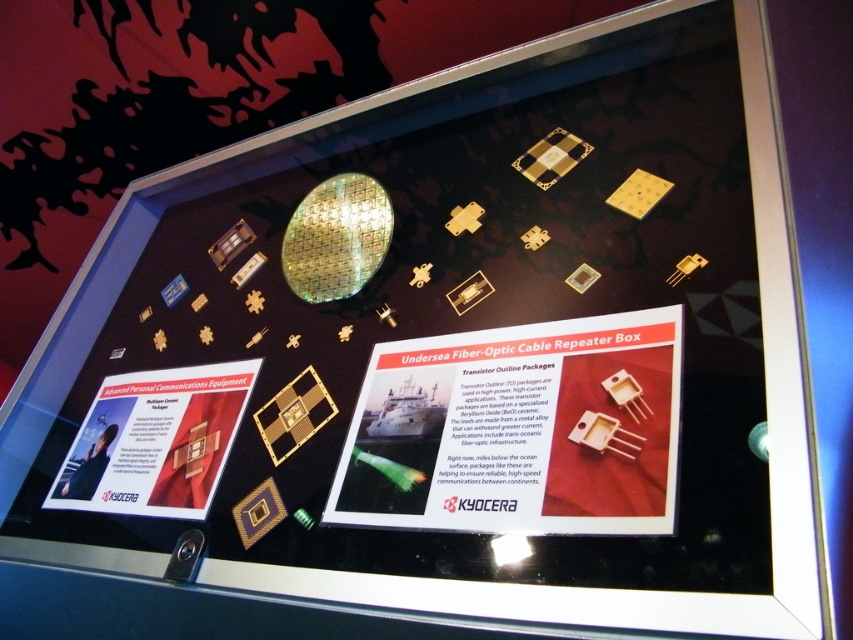
You are a museum visitor standing in front of the display case. You notice the white glossy poster at lower left and the gold metallic square at center. Which object is taller?

The white glossy poster at lower left has a greater height compared to the gold metallic square at center, so the white glossy poster at lower left is taller.